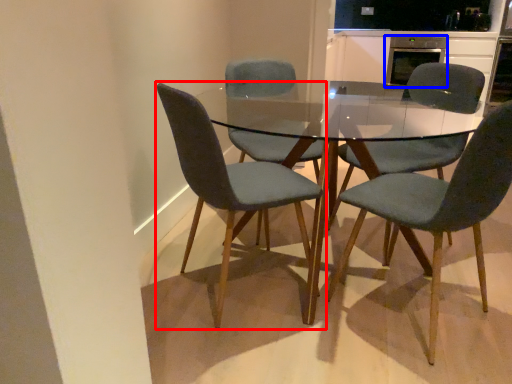
Question: Which point is further to the camera, chair (highlighted by a red box) or appliance (highlighted by a blue box)?

Choices:
 (A) chair
 (B) appliance

Answer: (B)